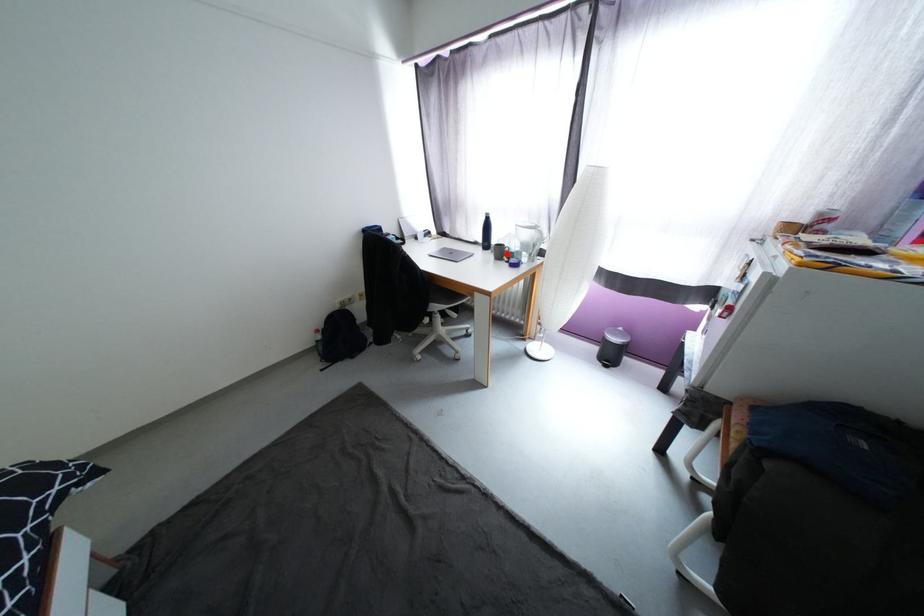
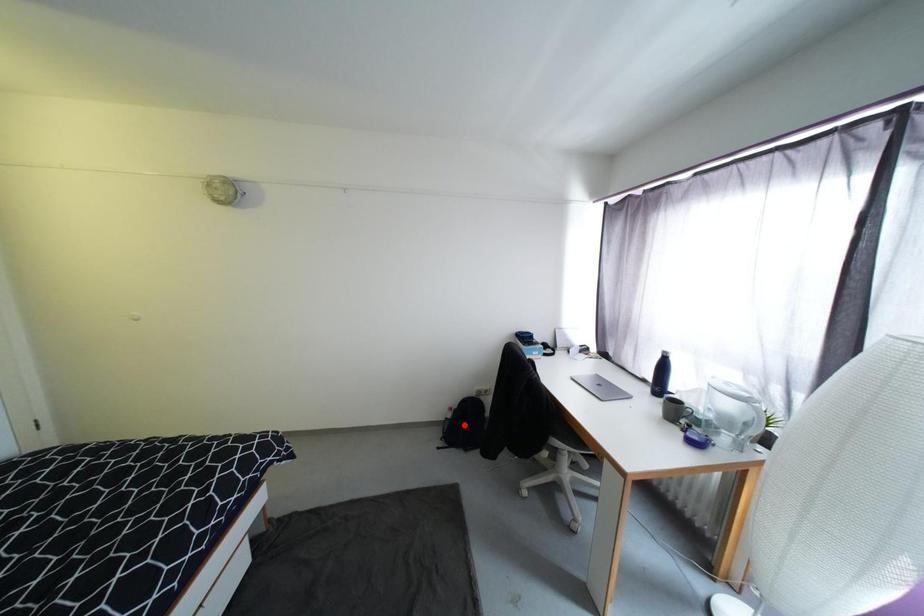
I am providing you with two images of the same scene from different viewpoints. A red point is marked on the first image and another point is marked on the second image. Does the point marked in image1 correspond to the same location as the one in image2?

No